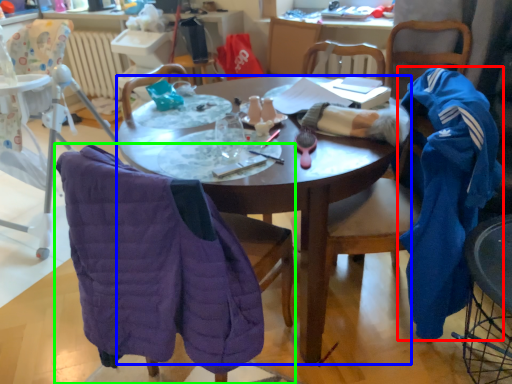
Question: Which object is positioned farthest from clothing (highlighted by a red box)? Select from desk (highlighted by a blue box) and chair (highlighted by a green box).

Choices:
 (A) desk
 (B) chair

Answer: (B)